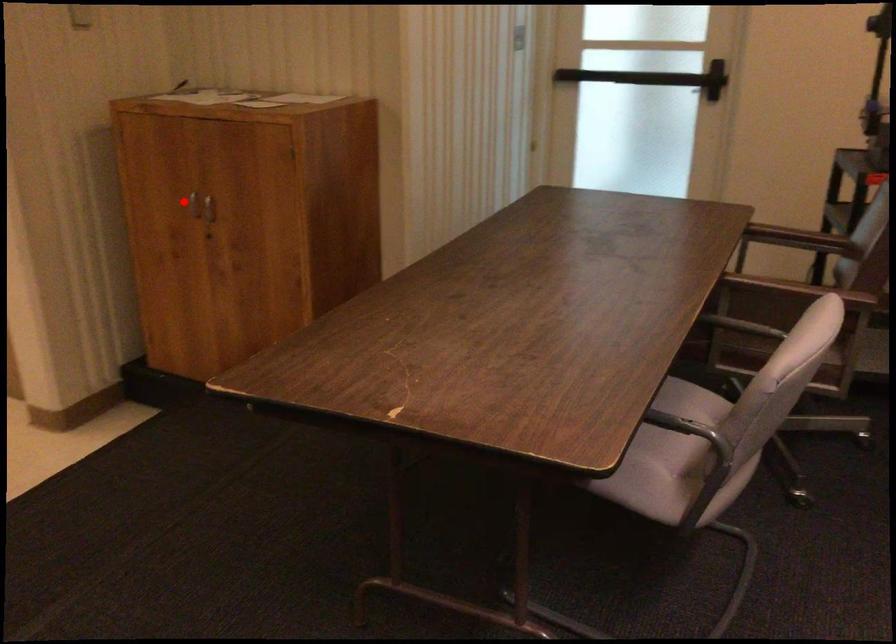
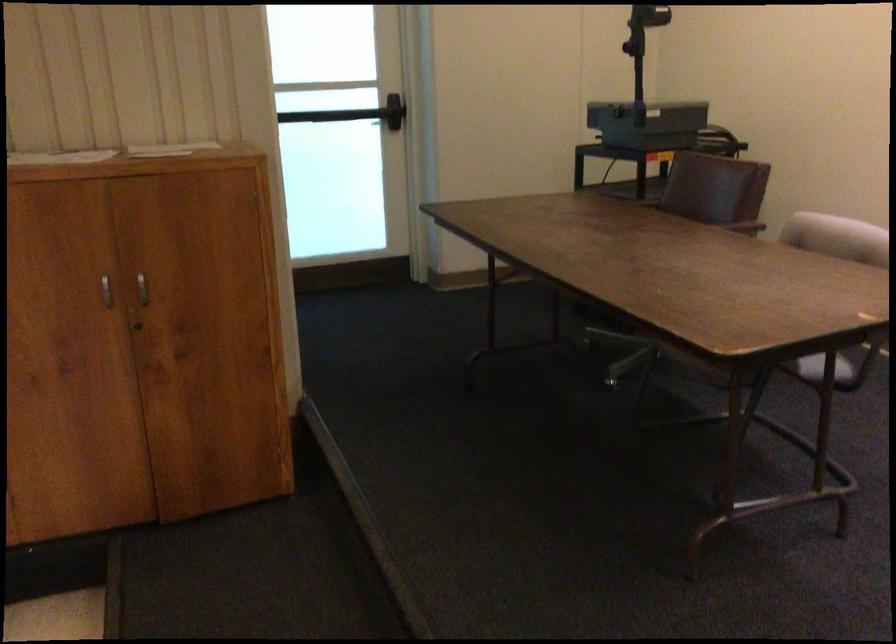
Where in the second image is the point corresponding to the highlighted location from the first image?

(106, 290)